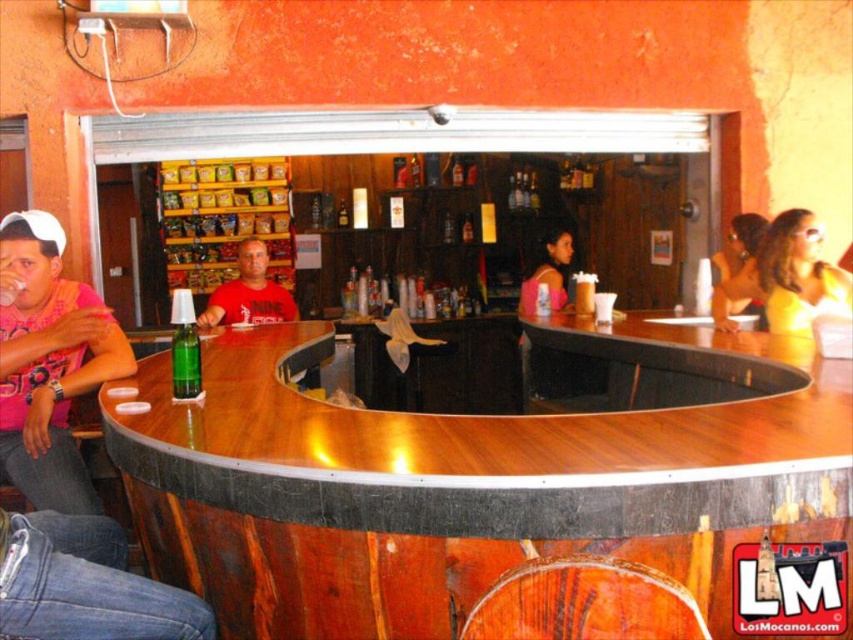
Is pink matte shirt at left bigger than yellow matte shirt at right?

Correct, pink matte shirt at left is larger in size than yellow matte shirt at right.

From the picture: Which is more to the left, pink matte shirt at left or yellow matte shirt at right?

From the viewer's perspective, pink matte shirt at left appears more on the left side.

This screenshot has height=640, width=853. Describe the element at coordinates (48, 362) in the screenshot. I see `pink matte shirt at left` at that location.

You are a GUI agent. You are given a task and a screenshot of the screen. Output one action in this format:
    pyautogui.click(x=<x>, y=<y>)
    Task: Click on the pink matte shirt at left
    The image size is (853, 640).
    Given the screenshot: What is the action you would take?
    pos(48,362)

What do you see at coordinates (248, 292) in the screenshot?
I see `matte red shirt at center` at bounding box center [248, 292].

Locate an element on the screen. matte red shirt at center is located at coordinates (248, 292).

You are a GUI agent. You are given a task and a screenshot of the screen. Output one action in this format:
    pyautogui.click(x=<x>, y=<y>)
    Task: Click on the matte red shirt at center
    The image size is (853, 640).
    Given the screenshot: What is the action you would take?
    pyautogui.click(x=248, y=292)

Between pink matte shirt at left and matte red shirt at center, which one has more height?

With more height is pink matte shirt at left.

Between pink matte shirt at left and matte red shirt at center, which one is positioned higher?

matte red shirt at center is higher up.

Locate an element on the screen. The width and height of the screenshot is (853, 640). pink matte shirt at left is located at coordinates (48, 362).

At what (x,y) coordinates should I click in order to perform the action: click on pink matte shirt at left. Please return your answer as a coordinate pair (x, y). Looking at the image, I should click on (48, 362).